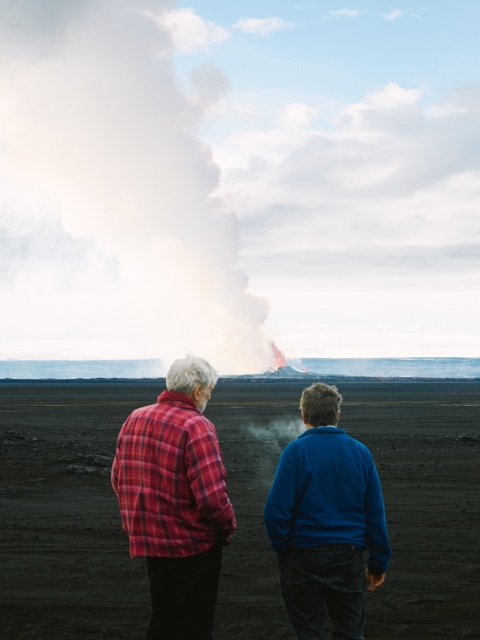
Which is behind, point (124, 307) or point (187, 556)?

The point (124, 307) is more distant.

Does point (187, 129) come farther from viewer compared to point (132, 513)?

Yes.

Does point (117, 26) come farther from viewer compared to point (208, 518)?

Yes.

You are a GUI agent. You are given a task and a screenshot of the screen. Output one action in this format:
    pyautogui.click(x=<x>, y=<y>)
    Task: Click on the white smoke at upper center
    
    Given the screenshot: What is the action you would take?
    pyautogui.click(x=117, y=189)

Is white smoke at upper center positioned before blue fleece jacket at center?

No, it is behind blue fleece jacket at center.

Where is `white smoke at upper center`? This screenshot has height=640, width=480. white smoke at upper center is located at coordinates (117, 189).

At what (x,y) coordinates should I click in order to perform the action: click on white smoke at upper center. Please return your answer as a coordinate pair (x, y). Looking at the image, I should click on (117, 189).

Who is higher up, plaid fabric shirt at center or red plaid shirt at center?

red plaid shirt at center

Is plaid fabric shirt at center wider than red plaid shirt at center?

Indeed, plaid fabric shirt at center has a greater width compared to red plaid shirt at center.

Consider the image. Who is more forward, (357, 596) or (218, 516)?

Point (357, 596) is in front.

Image resolution: width=480 pixels, height=640 pixels. I want to click on plaid fabric shirt at center, so click(176, 500).